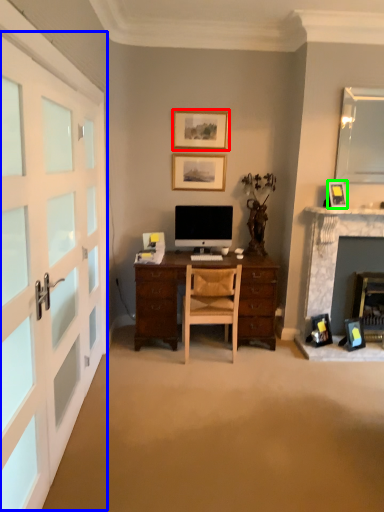
Question: Which is farther away from picture frame (highlighted by a red box)? garage door (highlighted by a blue box) or picture frame (highlighted by a green box)?

Choices:
 (A) garage door
 (B) picture frame

Answer: (A)